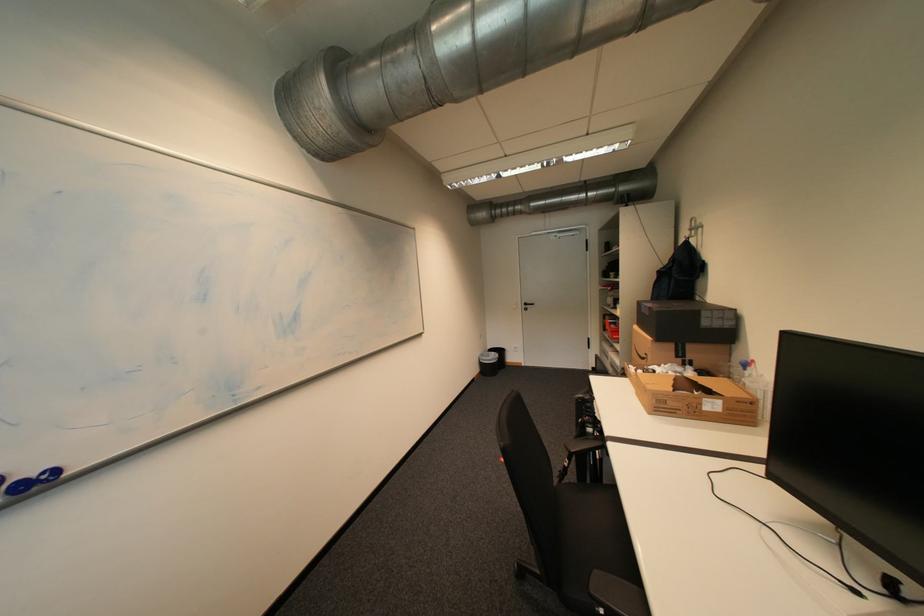
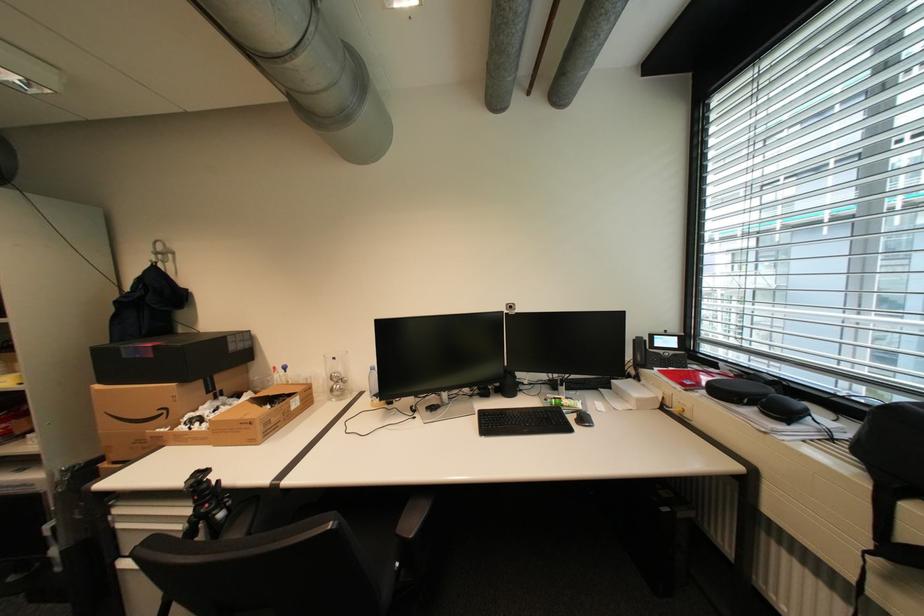
Find the pixel in the second image that matches [699,230] in the first image.

(165, 254)